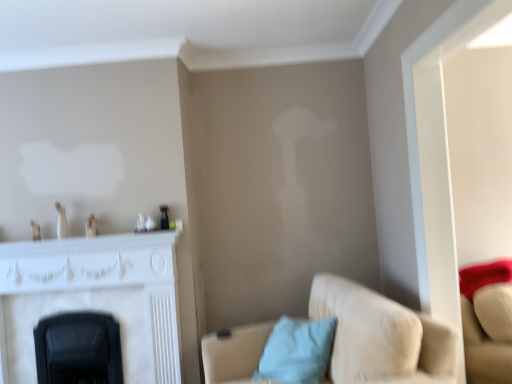
Question: Visually, is white marble fireplace at left positioned to the left or to the right of light blue fabric pillow at lower center?

Choices:
 (A) right
 (B) left

Answer: (B)

Question: Which is correct: white marble fireplace at left is inside light blue fabric pillow at lower center, or outside of it?

Choices:
 (A) outside
 (B) inside

Answer: (A)

Question: Based on their relative distances, which object is farther from the white marble fireplace at left?

Choices:
 (A) suede beige couch at lower right
 (B) light blue fabric pillow at lower center

Answer: (A)

Question: Estimate the real-world distances between objects in this image. Which object is closer to the light blue fabric pillow at lower center?

Choices:
 (A) white marble fireplace at left
 (B) suede beige couch at lower right

Answer: (B)